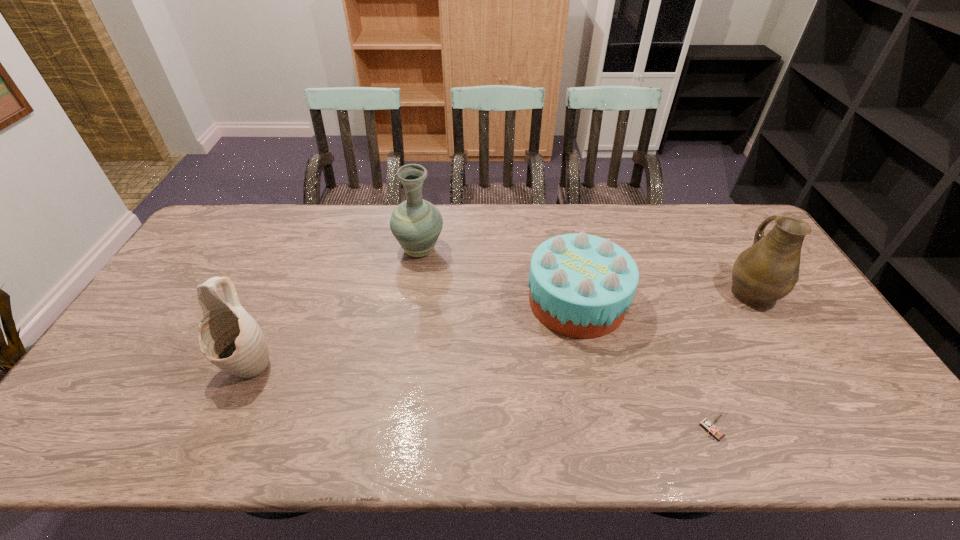
Where is `free location located 0.150m on the handle side of the farthest object`? This screenshot has width=960, height=540. free location located 0.150m on the handle side of the farthest object is located at coordinates (426, 210).

The width and height of the screenshot is (960, 540). In order to click on free spot located on the handle side of the farthest object in this screenshot , I will do `click(423, 226)`.

Locate an element on the screen. This screenshot has height=540, width=960. free space located on the handle side of the farthest object is located at coordinates (424, 221).

Locate an element on the screen. The width and height of the screenshot is (960, 540). vacant region located at the spout of the leftmost pitcher is located at coordinates (228, 412).

At what (x,y) coordinates should I click in order to perform the action: click on free space located 0.350m on the handle side of the second farthest pitcher. Please return your answer as a coordinate pair (x, y). This screenshot has width=960, height=540. Looking at the image, I should click on (699, 207).

Locate an element on the screen. This screenshot has height=540, width=960. blank space located 0.170m on the handle side of the second farthest pitcher is located at coordinates (717, 237).

Image resolution: width=960 pixels, height=540 pixels. Find the location of `vacant space located 0.350m on the handle side of the second farthest pitcher`. vacant space located 0.350m on the handle side of the second farthest pitcher is located at coordinates tap(699, 207).

The width and height of the screenshot is (960, 540). Identify the location of vacant space situated on the right of the third object from right to left. (647, 301).

This screenshot has width=960, height=540. In order to click on blank space located on the left of the nearest object in this screenshot , I will do `click(622, 430)`.

Where is `object present at the far edge`? object present at the far edge is located at coordinates (416, 223).